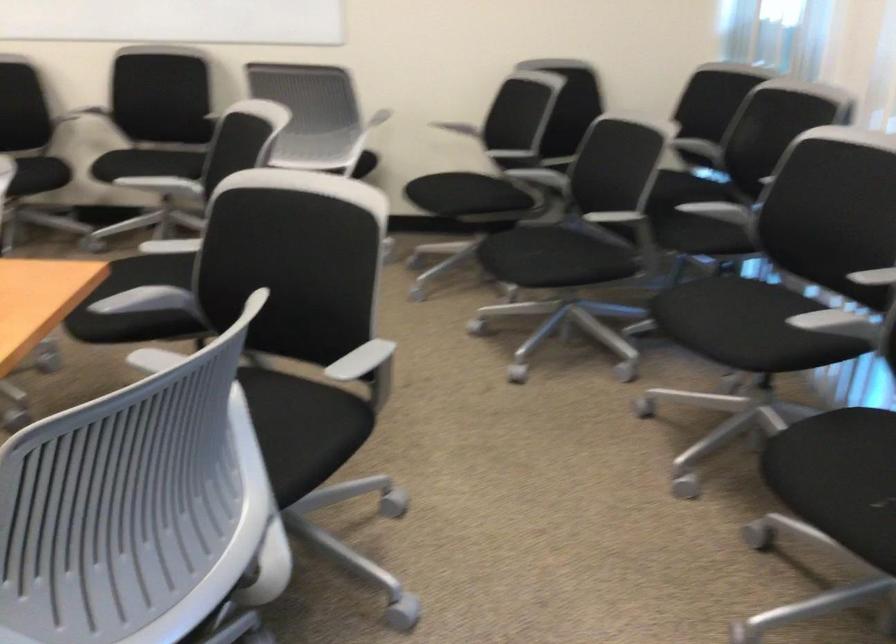
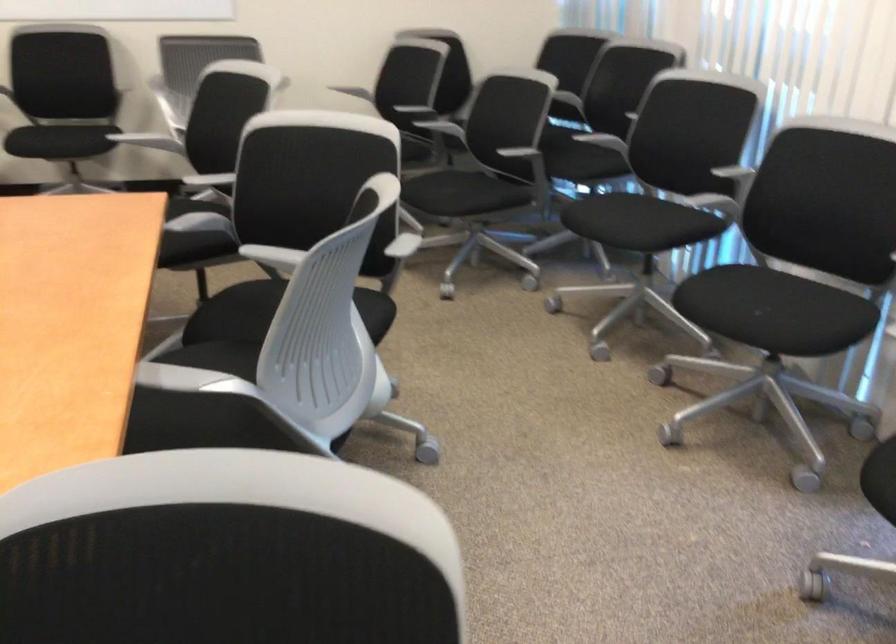
Find the pixel in the second image that matches point (545, 269) in the first image.

(462, 200)